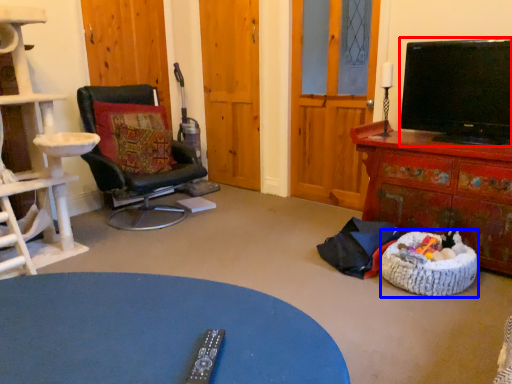
Question: Which of the following is the farthest to the observer, television (highlighted by a red box) or dog bed (highlighted by a blue box)?

Choices:
 (A) television
 (B) dog bed

Answer: (A)